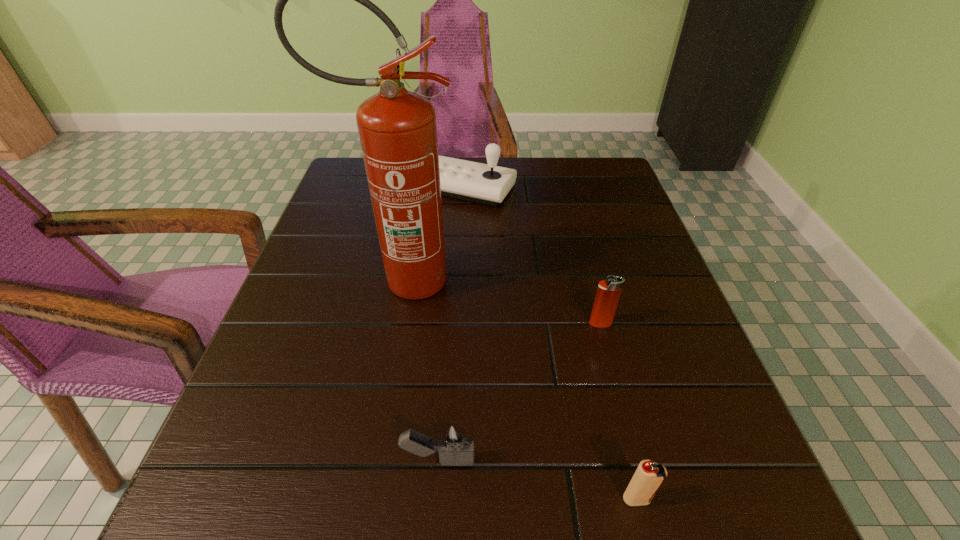
Locate an element on the screen. Image resolution: width=960 pixels, height=540 pixels. vacant space at the far right corner of the desktop is located at coordinates (575, 184).

The height and width of the screenshot is (540, 960). I want to click on free space between the farthest igniter and the second farthest igniter, so click(519, 392).

The image size is (960, 540). In order to click on empty space that is in between the fire extinguisher and the farthest igniter in this screenshot , I will do `click(501, 302)`.

At what (x,y) coordinates should I click in order to perform the action: click on unoccupied position between the fire extinguisher and the second farthest igniter. Please return your answer as a coordinate pair (x, y). The image size is (960, 540). Looking at the image, I should click on (420, 370).

You are a GUI agent. You are given a task and a screenshot of the screen. Output one action in this format:
    pyautogui.click(x=<x>, y=<y>)
    Task: Click on the empty space that is in between the joystick and the farthest igniter
    Image resolution: width=960 pixels, height=540 pixels.
    Given the screenshot: What is the action you would take?
    pyautogui.click(x=532, y=255)

Identify the location of vacant space that's between the farthest object and the farthest igniter. (532, 255).

This screenshot has width=960, height=540. Find the location of `empty space that is in between the second nearest igniter and the nearest object`. empty space that is in between the second nearest igniter and the nearest object is located at coordinates (538, 480).

Where is `unoccupied position between the second nearest object and the tallest object`? Image resolution: width=960 pixels, height=540 pixels. unoccupied position between the second nearest object and the tallest object is located at coordinates (420, 370).

Where is `unoccupied position between the farthest object and the fourth farthest object`? unoccupied position between the farthest object and the fourth farthest object is located at coordinates (451, 324).

Identify the location of empty space that is in between the joystick and the nearest object. (550, 343).